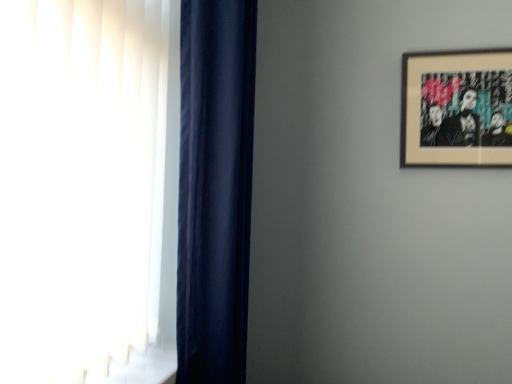
Question: Considering their positions, is wooden-framed artwork at upper right located in front of or behind navy velvet curtain at left?

Choices:
 (A) behind
 (B) front

Answer: (A)

Question: In terms of size, does wooden-framed artwork at upper right appear bigger or smaller than navy velvet curtain at left?

Choices:
 (A) big
 (B) small

Answer: (B)

Question: In terms of height, does wooden-framed artwork at upper right look taller or shorter compared to navy velvet curtain at left?

Choices:
 (A) tall
 (B) short

Answer: (B)

Question: Looking at the image, does navy velvet curtain at left seem bigger or smaller compared to wooden-framed artwork at upper right?

Choices:
 (A) big
 (B) small

Answer: (A)

Question: Would you say navy velvet curtain at left is inside or outside wooden-framed artwork at upper right?

Choices:
 (A) outside
 (B) inside

Answer: (A)

Question: From the image's perspective, relative to wooden-framed artwork at upper right, is navy velvet curtain at left above or below?

Choices:
 (A) above
 (B) below

Answer: (B)

Question: Considering the positions of navy velvet curtain at left and wooden-framed artwork at upper right in the image, is navy velvet curtain at left taller or shorter than wooden-framed artwork at upper right?

Choices:
 (A) short
 (B) tall

Answer: (B)